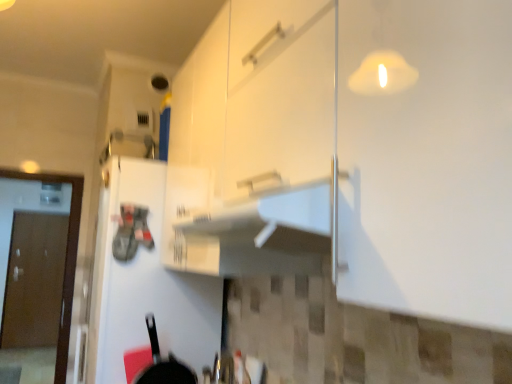
Describe the element at coordinates (146, 281) in the screenshot. I see `white matte refrigerator at left, acting as the 2th door starting from the left` at that location.

You are a GUI agent. You are given a task and a screenshot of the screen. Output one action in this format:
    pyautogui.click(x=<x>, y=<y>)
    Task: Click on the brown matte door at left, which ranks as the 2th door in right-to-left order
    The height and width of the screenshot is (384, 512).
    Given the screenshot: What is the action you would take?
    pyautogui.click(x=34, y=281)

This screenshot has height=384, width=512. I want to click on black matte frying pan at lower left, so click(x=163, y=363).

Which object is further away from the camera, brown matte door at left, which is the 2th door in front-to-back order, or white matte refrigerator at left, acting as the 2th door starting from the left?

brown matte door at left, which is the 2th door in front-to-back order, is further away from the camera.

Consider the image. Is brown matte door at left, which is counted as the 1th door, starting from the back, directly adjacent to white matte refrigerator at left, positioned as the first door in right-to-left order?

brown matte door at left, which is counted as the 1th door, starting from the back, and white matte refrigerator at left, positioned as the first door in right-to-left order, are not in contact.

Could you tell me if brown matte door at left, which is counted as the 1th door, starting from the back, is facing white matte refrigerator at left, the 2th door positioned from the back?

Yes.

From the image's perspective, is brown matte door at left, placed as the first door when sorted from left to right, above or below white matte refrigerator at left, which is the 1th door in front-to-back order?

brown matte door at left, placed as the first door when sorted from left to right, is below white matte refrigerator at left, which is the 1th door in front-to-back order.

Considering the sizes of objects brown matte door at left, which is the 2th door in front-to-back order, and black matte frying pan at lower left in the image provided, who is thinner, brown matte door at left, which is the 2th door in front-to-back order, or black matte frying pan at lower left?

black matte frying pan at lower left.

Is brown matte door at left, which is the 2th door in front-to-back order, next to black matte frying pan at lower left?

brown matte door at left, which is the 2th door in front-to-back order, is not next to black matte frying pan at lower left, and they're not touching.

Can you confirm if brown matte door at left, which is counted as the 1th door, starting from the back, is positioned to the left of black matte frying pan at lower left?

Indeed, brown matte door at left, which is counted as the 1th door, starting from the back, is positioned on the left side of black matte frying pan at lower left.

Identify the location of door that appears below the black matte frying pan at lower left (from the image's perspective). (34, 281).

Looking at this image, which is less distant, (142, 377) or (18, 334)?

Point (142, 377) is positioned closer to the camera compared to point (18, 334).

From the image's perspective, does black matte frying pan at lower left appear lower than brown matte door at left, which is the 2th door in front-to-back order?

No, from the image's perspective, black matte frying pan at lower left is not below brown matte door at left, which is the 2th door in front-to-back order.

Is black matte frying pan at lower left looking in the opposite direction of brown matte door at left, placed as the first door when sorted from left to right?

Yes, black matte frying pan at lower left's orientation is away from brown matte door at left, placed as the first door when sorted from left to right.

Considering the relative positions of white matte refrigerator at left, positioned as the first door in right-to-left order, and black matte frying pan at lower left in the image provided, is white matte refrigerator at left, positioned as the first door in right-to-left order, behind black matte frying pan at lower left?

Yes, white matte refrigerator at left, positioned as the first door in right-to-left order, is further from the camera.

Does point (162, 336) appear closer or farther from the camera than point (153, 370)?

Point (162, 336) is farther from the camera than point (153, 370).

Is white matte refrigerator at left, which is the 1th door in front-to-back order, bigger than black matte frying pan at lower left?

Correct, white matte refrigerator at left, which is the 1th door in front-to-back order, is larger in size than black matte frying pan at lower left.

Based on the photo, is white matte refrigerator at left, the 2th door positioned from the back, oriented towards black matte frying pan at lower left?

No, white matte refrigerator at left, the 2th door positioned from the back, is not oriented towards black matte frying pan at lower left.

Is black matte frying pan at lower left facing away from white matte refrigerator at left, the 2th door positioned from the back?

Absolutely, black matte frying pan at lower left is directed away from white matte refrigerator at left, the 2th door positioned from the back.

Between black matte frying pan at lower left and white matte refrigerator at left, which is the 1th door in front-to-back order, which one is positioned in front?

Positioned in front is black matte frying pan at lower left.

Considering the sizes of black matte frying pan at lower left and white matte refrigerator at left, positioned as the first door in right-to-left order, in the image, is black matte frying pan at lower left taller or shorter than white matte refrigerator at left, positioned as the first door in right-to-left order,?

Clearly, black matte frying pan at lower left is shorter compared to white matte refrigerator at left, positioned as the first door in right-to-left order.

Who is bigger, black matte frying pan at lower left or white matte refrigerator at left, acting as the 2th door starting from the left?

With larger size is white matte refrigerator at left, acting as the 2th door starting from the left.

Considering the sizes of white matte refrigerator at left, positioned as the first door in right-to-left order, and brown matte door at left, which is counted as the 1th door, starting from the back, in the image, is white matte refrigerator at left, positioned as the first door in right-to-left order, wider or thinner than brown matte door at left, which is counted as the 1th door, starting from the back,?

Considering their sizes, white matte refrigerator at left, positioned as the first door in right-to-left order, looks broader than brown matte door at left, which is counted as the 1th door, starting from the back.

Based on the photo, from their relative heights in the image, would you say white matte refrigerator at left, positioned as the first door in right-to-left order, is taller or shorter than brown matte door at left, placed as the first door when sorted from left to right?

In the image, white matte refrigerator at left, positioned as the first door in right-to-left order, appears to be shorter than brown matte door at left, placed as the first door when sorted from left to right.

From the image's perspective, which is above, white matte refrigerator at left, the 2th door positioned from the back, or brown matte door at left, which is the 2th door in front-to-back order?

white matte refrigerator at left, the 2th door positioned from the back, is shown above in the image.

The image size is (512, 384). I want to click on door on the left of the white matte refrigerator at left, acting as the 2th door starting from the left, so (34, 281).

This screenshot has height=384, width=512. I want to click on frying pan above the brown matte door at left, which is counted as the 1th door, starting from the back (from the image's perspective), so click(x=163, y=363).

From the image, which object appears to be farther from black matte frying pan at lower left, brown matte door at left, placed as the first door when sorted from left to right, or white matte refrigerator at left, the 2th door positioned from the back?

Based on the image, brown matte door at left, placed as the first door when sorted from left to right, appears to be further to black matte frying pan at lower left.

Based on their spatial positions, is white matte refrigerator at left, acting as the 2th door starting from the left, or black matte frying pan at lower left closer to brown matte door at left, which ranks as the 2th door in right-to-left order?

The object closer to brown matte door at left, which ranks as the 2th door in right-to-left order, is white matte refrigerator at left, acting as the 2th door starting from the left.

Which object lies further to the anchor point black matte frying pan at lower left, white matte refrigerator at left, positioned as the first door in right-to-left order, or brown matte door at left, which is counted as the 1th door, starting from the back?

brown matte door at left, which is counted as the 1th door, starting from the back.

Based on their spatial positions, is brown matte door at left, placed as the first door when sorted from left to right, or black matte frying pan at lower left further from white matte refrigerator at left, which is the 1th door in front-to-back order?

Among the two, brown matte door at left, placed as the first door when sorted from left to right, is located further to white matte refrigerator at left, which is the 1th door in front-to-back order.

Considering their positions, is black matte frying pan at lower left positioned further to white matte refrigerator at left, positioned as the first door in right-to-left order, than brown matte door at left, which is counted as the 1th door, starting from the back?

brown matte door at left, which is counted as the 1th door, starting from the back.

Which object lies further to the anchor point brown matte door at left, which ranks as the 2th door in right-to-left order, black matte frying pan at lower left or white matte refrigerator at left, the 2th door positioned from the back?

black matte frying pan at lower left is positioned further to the anchor brown matte door at left, which ranks as the 2th door in right-to-left order.

You are a GUI agent. You are given a task and a screenshot of the screen. Output one action in this format:
    pyautogui.click(x=<x>, y=<y>)
    Task: Click on the door between black matte frying pan at lower left and brown matte door at left, which ranks as the 2th door in right-to-left order, along the z-axis
    Image resolution: width=512 pixels, height=384 pixels.
    Given the screenshot: What is the action you would take?
    (146, 281)